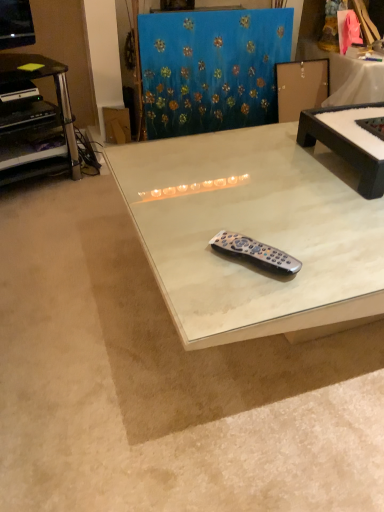
Where is `vacant space that's between black plastic remote at center and black matte table at center, the 2th table from the left`? The height and width of the screenshot is (512, 384). vacant space that's between black plastic remote at center and black matte table at center, the 2th table from the left is located at coordinates (308, 223).